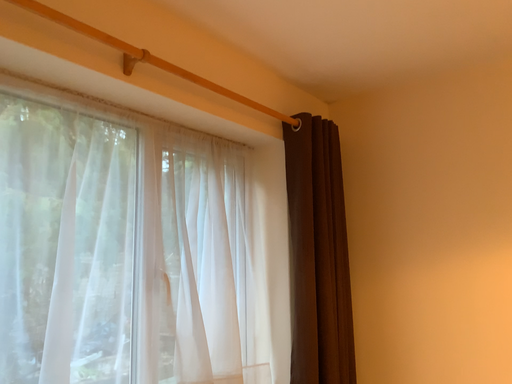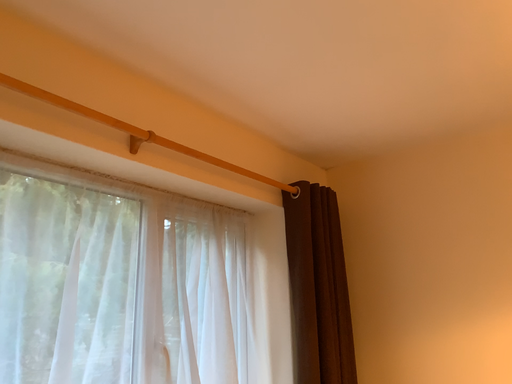
Question: Which way did the camera rotate in the video?

Choices:
 (A) rotated downward
 (B) rotated upward

Answer: (B)